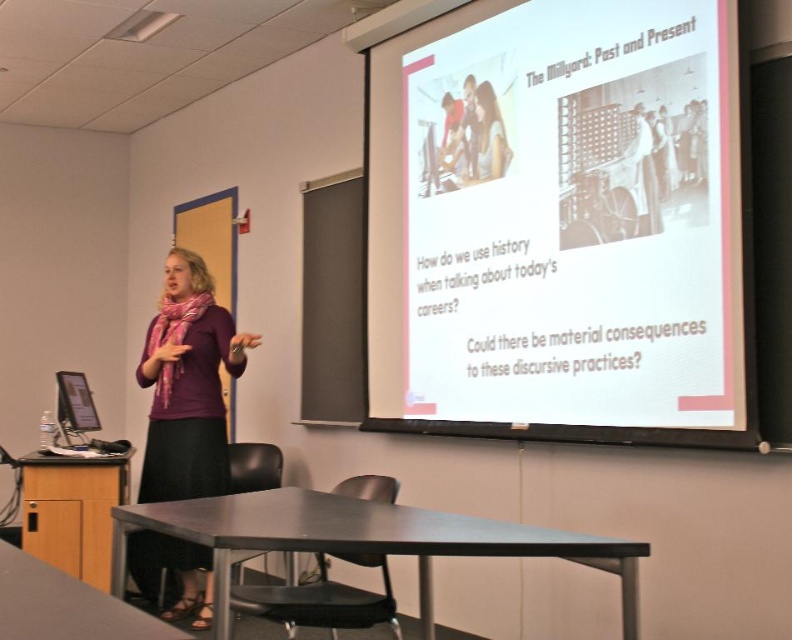
Where is `matte purple shirt at center`? matte purple shirt at center is located at coordinates (187, 385).

Which is more to the right, matte purple shirt at center or light brown hair at upper center?

light brown hair at upper center is more to the right.

What are the coordinates of `matte purple shirt at center` in the screenshot? It's located at (187, 385).

Does white paper at upper right have a greater height compared to light brown hair at upper center?

Indeed, white paper at upper right has a greater height compared to light brown hair at upper center.

Does white paper at upper right have a lesser height compared to light brown hair at upper center?

No, white paper at upper right is not shorter than light brown hair at upper center.

The image size is (792, 640). Find the location of `white paper at upper right`. white paper at upper right is located at coordinates (565, 230).

Who is higher up, white paper at upper right or matte purple shirt at center?

white paper at upper right is above.

Can you confirm if white paper at upper right is positioned to the left of matte purple shirt at center?

No, white paper at upper right is not to the left of matte purple shirt at center.

Identify the location of white paper at upper right. Image resolution: width=792 pixels, height=640 pixels. (565, 230).

Where is `white paper at upper right`? This screenshot has width=792, height=640. white paper at upper right is located at coordinates (565, 230).